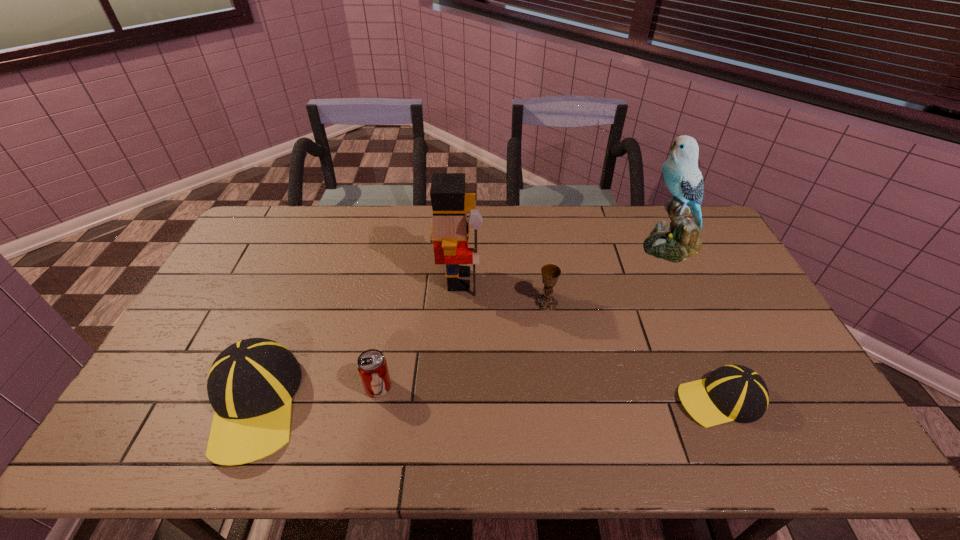
Choose which object is the second nearest neighbor to the pop soda. Please provide its 2D coordinates. Your answer should be formatted as a tuple, i.e. [(x, y)], where the tuple contains the x and y coordinates of a point satisfying the conditions above.

[(450, 231)]

Find the location of a particular element. Image resolution: width=960 pixels, height=540 pixels. free spot that satisfies the following two spatial constraints: 1. with the brim of the right baseball cap facing forward; 2. with the brim of the left baseball cap facing forward is located at coordinates (722, 404).

Where is `free space that satisfies the following two spatial constraints: 1. on the face of the parakeet; 2. with the brim of the taller baseball cap facing forward`? free space that satisfies the following two spatial constraints: 1. on the face of the parakeet; 2. with the brim of the taller baseball cap facing forward is located at coordinates (747, 404).

Locate an element on the screen. vacant space that satisfies the following two spatial constraints: 1. in front of the third object from left to right holding the staff; 2. on the left side of the fourth object from left to right is located at coordinates (458, 303).

Locate an element on the screen. blank area in the image that satisfies the following two spatial constraints: 1. in front of the fourth object from right to left holding the staff; 2. on the back side of the fourth object from left to right is located at coordinates point(458,303).

Identify the location of free space that satisfies the following two spatial constraints: 1. on the face of the parakeet; 2. with the brim of the leftmost object facing forward. The height and width of the screenshot is (540, 960). (747, 404).